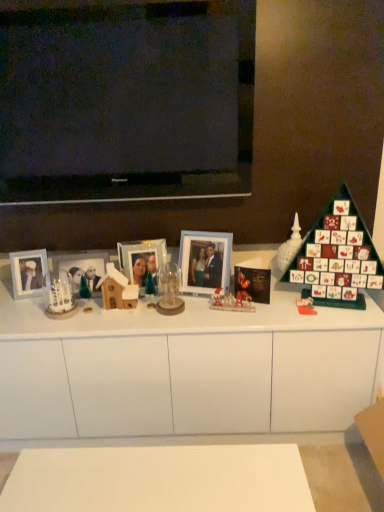
Question: From the image's perspective, is white frosted glass candle holder at left located beneath white matte cabinet at center?

Choices:
 (A) no
 (B) yes

Answer: (A)

Question: Considering the relative positions of white frosted glass candle holder at left and white matte cabinet at center in the image provided, is white frosted glass candle holder at left behind white matte cabinet at center?

Choices:
 (A) no
 (B) yes

Answer: (B)

Question: Is the surface of white frosted glass candle holder at left in direct contact with white matte cabinet at center?

Choices:
 (A) yes
 (B) no

Answer: (B)

Question: Considering the relative sizes of white frosted glass candle holder at left and white matte cabinet at center in the image provided, is white frosted glass candle holder at left bigger than white matte cabinet at center?

Choices:
 (A) yes
 (B) no

Answer: (B)

Question: Is there a large distance between white frosted glass candle holder at left and white matte cabinet at center?

Choices:
 (A) yes
 (B) no

Answer: (B)

Question: Is white matte cabinet at center spatially inside white glossy advent calendar at right, which is counted as the 2th toy, starting from the right, or outside of it?

Choices:
 (A) outside
 (B) inside

Answer: (A)

Question: Considering the positions of white matte cabinet at center and white glossy advent calendar at right, which is counted as the 2th toy, starting from the right, in the image, is white matte cabinet at center wider or thinner than white glossy advent calendar at right, which is counted as the 2th toy, starting from the right,?

Choices:
 (A) thin
 (B) wide

Answer: (B)

Question: Is point (36, 424) positioned closer to the camera than point (288, 258)?

Choices:
 (A) farther
 (B) closer

Answer: (B)

Question: Considering the relative positions of white matte cabinet at center and white glossy advent calendar at right, acting as the fourth toy starting from the left, in the image provided, is white matte cabinet at center to the left or to the right of white glossy advent calendar at right, acting as the fourth toy starting from the left,?

Choices:
 (A) left
 (B) right

Answer: (A)

Question: In the image, is white frosted glass candle holder at left positioned in front of or behind matte glass photo frame at center, which is the 4th picture frame from left to right?

Choices:
 (A) behind
 (B) front

Answer: (B)

Question: Is white frosted glass candle holder at left spatially inside matte glass photo frame at center, which is the 4th picture frame from left to right, or outside of it?

Choices:
 (A) outside
 (B) inside

Answer: (A)

Question: In terms of height, does white frosted glass candle holder at left look taller or shorter compared to matte glass photo frame at center, the first picture frame in the right-to-left sequence?

Choices:
 (A) tall
 (B) short

Answer: (B)

Question: Visually, is white frosted glass candle holder at left positioned to the left or to the right of matte glass photo frame at center, which is the 4th picture frame from left to right?

Choices:
 (A) right
 (B) left

Answer: (B)

Question: In terms of width, does clear glass ornament at center, positioned as the fourth toy in right-to-left order, look wider or thinner when compared to white matte cabinet at center?

Choices:
 (A) wide
 (B) thin

Answer: (B)

Question: Considering the positions of clear glass ornament at center, which is counted as the second toy, starting from the left, and white matte cabinet at center in the image, is clear glass ornament at center, which is counted as the second toy, starting from the left, bigger or smaller than white matte cabinet at center?

Choices:
 (A) small
 (B) big

Answer: (A)